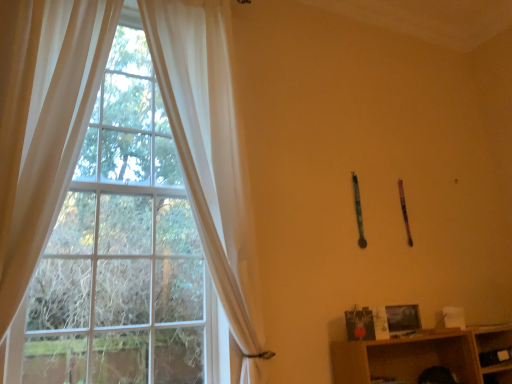
Question: From a real-world perspective, is white sheer curtain at left, acting as the first curtain starting from the right, physically located above or below white sheer curtain at left, which ranks as the first curtain in left-to-right order?

Choices:
 (A) above
 (B) below

Answer: (A)

Question: Considering the positions of white sheer curtain at left, arranged as the 2th curtain when viewed from the left, and white sheer curtain at left, the 2th curtain from the right, in the image, is white sheer curtain at left, arranged as the 2th curtain when viewed from the left, bigger or smaller than white sheer curtain at left, the 2th curtain from the right,?

Choices:
 (A) small
 (B) big

Answer: (B)

Question: Choose the correct answer: Is white sheer curtain at left, arranged as the 2th curtain when viewed from the left, inside white sheer curtain at left, which ranks as the first curtain in left-to-right order, or outside it?

Choices:
 (A) inside
 (B) outside

Answer: (B)

Question: Is white sheer curtain at left, which ranks as the first curtain in left-to-right order, taller or shorter than white sheer curtain at left, acting as the first curtain starting from the right?

Choices:
 (A) tall
 (B) short

Answer: (B)

Question: In terms of width, does white sheer curtain at left, the 2th curtain from the right, look wider or thinner when compared to white sheer curtain at left, arranged as the 2th curtain when viewed from the left?

Choices:
 (A) wide
 (B) thin

Answer: (A)

Question: From a real-world perspective, is white sheer curtain at left, which ranks as the first curtain in left-to-right order, physically located above or below white sheer curtain at left, acting as the first curtain starting from the right?

Choices:
 (A) above
 (B) below

Answer: (B)

Question: Is white sheer curtain at left, which ranks as the first curtain in left-to-right order, inside the boundaries of white sheer curtain at left, arranged as the 2th curtain when viewed from the left, or outside?

Choices:
 (A) outside
 (B) inside

Answer: (A)